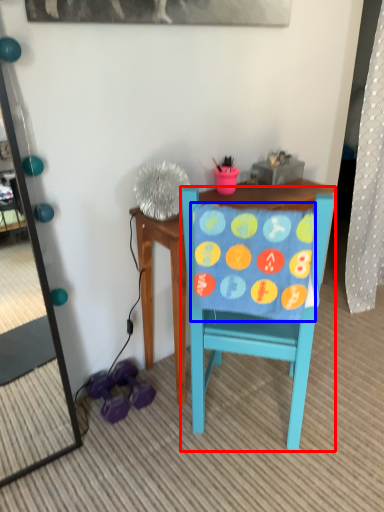
Question: Which object appears closest to the camera in this image, chair (highlighted by a red box) or blanket (highlighted by a blue box)?

Choices:
 (A) chair
 (B) blanket

Answer: (B)